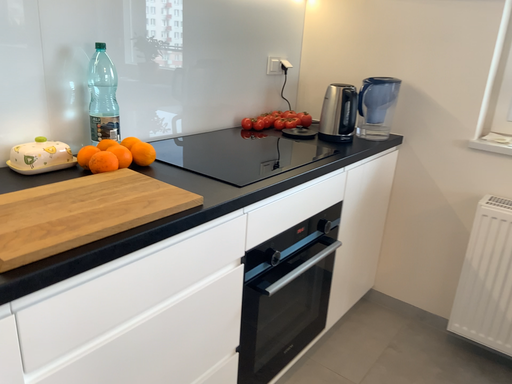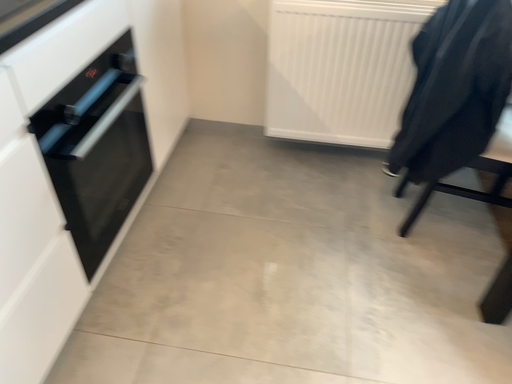
Question: Which way did the camera rotate in the video?

Choices:
 (A) rotated left
 (B) rotated right

Answer: (B)